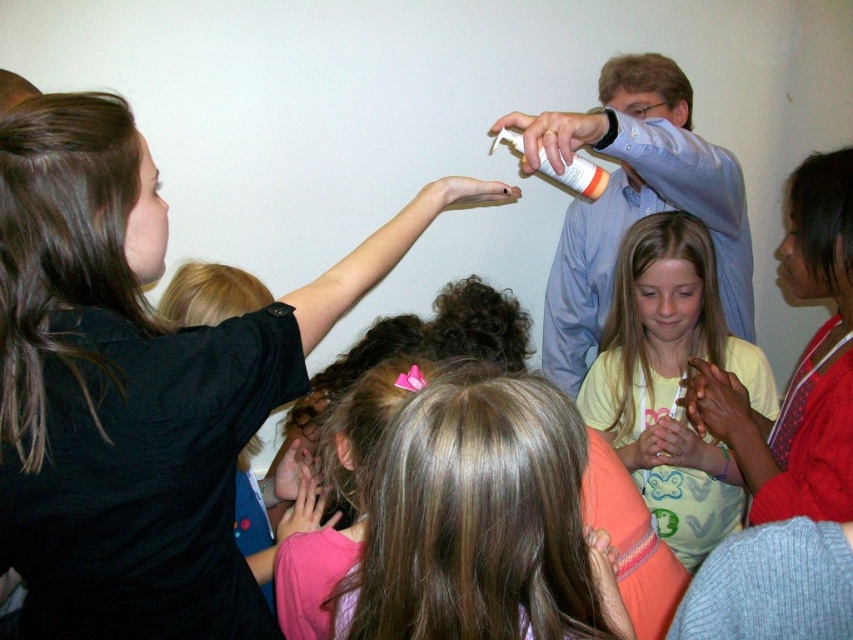
You are standing in the room and want to move towards the two points marked in the scene. Which point, point (433, 406) or point (515, 138), will you reach first?

Point (433, 406) is closer to the viewer than point (515, 138), so you will reach point (433, 406) first.

You are standing in the room and want to move from the point at [625,301] to the point at [601,170]. Which direction should you move in to get closer to the second point?

You should move towards the left and slightly forward since point [601,170] is to the left and closer to you compared to point [625,301].

You are a photographer trying to capture a candid shot of the group. You notice the blonde hair at center and the white plastic bottle at upper center. Which object should you focus on first to ensure it appears larger in the photo?

The blonde hair at center should be focused on first because it has a greater height compared to the white plastic bottle at upper center, making it naturally larger in the frame.